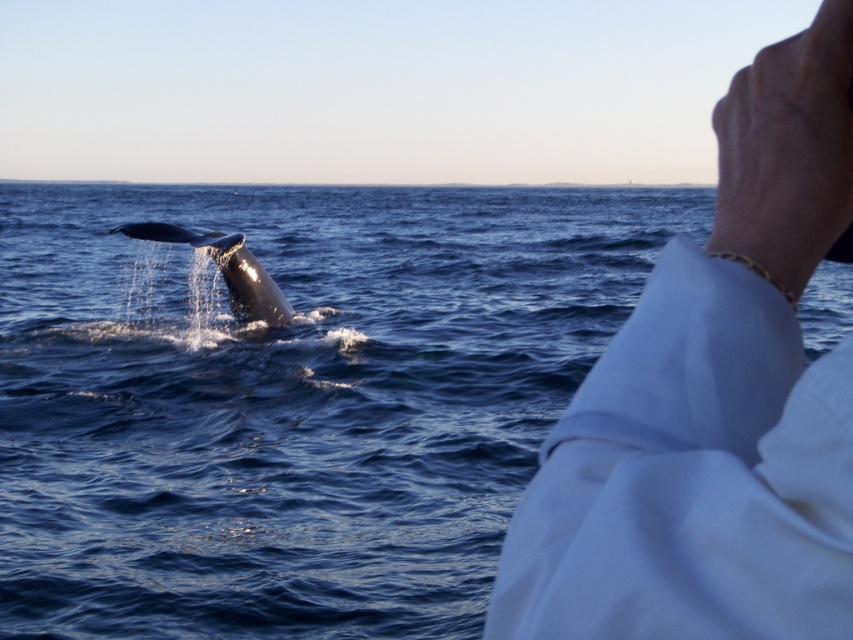
You are standing on a boat and see the white cloth at upper right and the gray smooth whale at left. Which object is closer to the horizon?

The white cloth at upper right is closer to the horizon than the gray smooth whale at left because it has a lesser height, making it appear farther away in the distance.

You are a photographer trying to capture the whale in the scene. You notice a white cloth at upper right and a gray smooth whale at left. Which object is positioned lower in the image?

The white cloth at upper right is positioned below the gray smooth whale at left, so it is lower in the image.